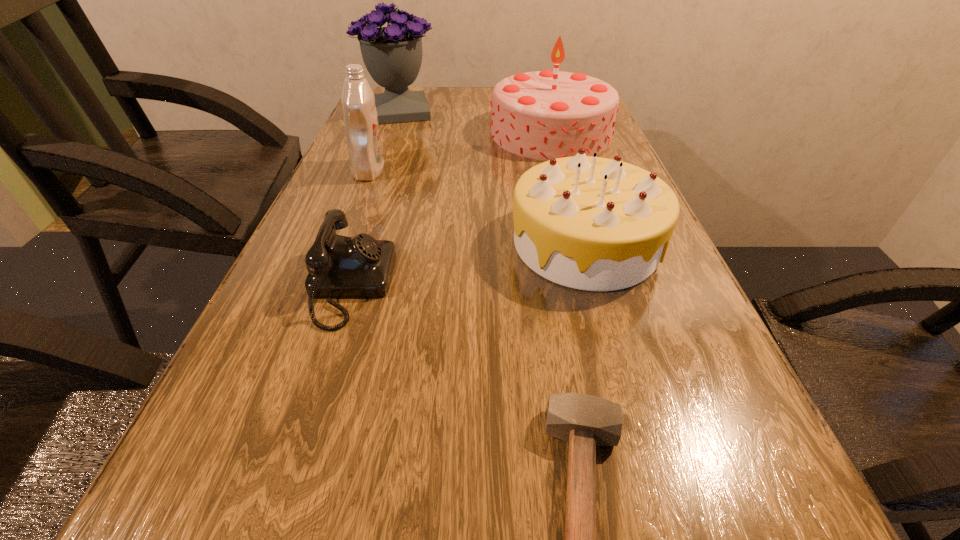
You are a GUI agent. You are given a task and a screenshot of the screen. Output one action in this format:
    pyautogui.click(x=<x>, y=<y>)
    Task: Click on the free space between the bouquet and the taller birthday cake
    The width and height of the screenshot is (960, 540).
    Given the screenshot: What is the action you would take?
    pyautogui.click(x=475, y=122)

Locate an element on the screen. blank region between the telephone and the detergent is located at coordinates (360, 228).

The image size is (960, 540). Identify the location of empty space that is in between the fifth tallest object and the nearer birthday cake. 468,264.

The width and height of the screenshot is (960, 540). Identify the location of unoccupied area between the detergent and the telephone. (360, 228).

The image size is (960, 540). I want to click on vacant area between the detergent and the taller birthday cake, so click(x=460, y=152).

In order to click on object that is the second nearest to the nearer birthday cake in this screenshot , I will do `click(585, 421)`.

Locate which object is the fourth closest to the detergent. Please provide its 2D coordinates. Your answer should be formatted as a tuple, i.e. [(x, y)], where the tuple contains the x and y coordinates of a point satisfying the conditions above.

[(589, 223)]